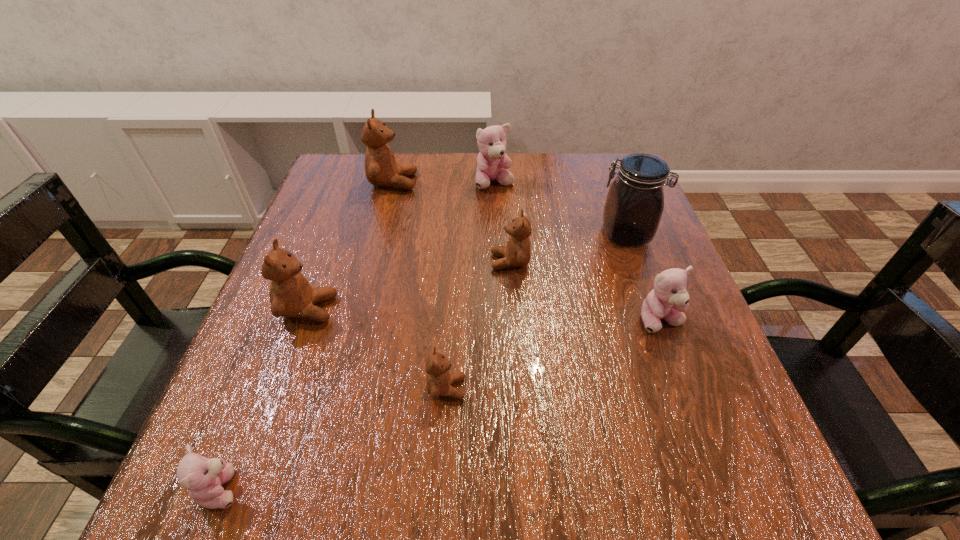
This screenshot has width=960, height=540. What are the coordinates of `the biggest brown teddy bear` in the screenshot? It's located at (381, 169).

Locate an element on the screen. the tallest teddy bear is located at coordinates (381, 169).

Locate an element on the screen. The height and width of the screenshot is (540, 960). jar is located at coordinates (634, 205).

Locate an element on the screen. This screenshot has height=540, width=960. the second pink teddy bear from left to right is located at coordinates (492, 141).

What are the coordinates of `the biggest pink teddy bear` in the screenshot? It's located at (492, 141).

This screenshot has height=540, width=960. In order to click on the second nearest brown teddy bear in this screenshot , I will do `click(291, 295)`.

I want to click on the third farthest teddy bear, so click(x=517, y=253).

Locate an element on the screen. This screenshot has height=540, width=960. the second farthest brown teddy bear is located at coordinates (517, 253).

Where is `the second nearest pink teddy bear`? Image resolution: width=960 pixels, height=540 pixels. the second nearest pink teddy bear is located at coordinates pyautogui.click(x=668, y=300).

You are a GUI agent. You are given a task and a screenshot of the screen. Output one action in this format:
    pyautogui.click(x=<x>, y=<y>)
    Task: Click on the rightmost teddy bear
    
    Given the screenshot: What is the action you would take?
    pyautogui.click(x=668, y=300)